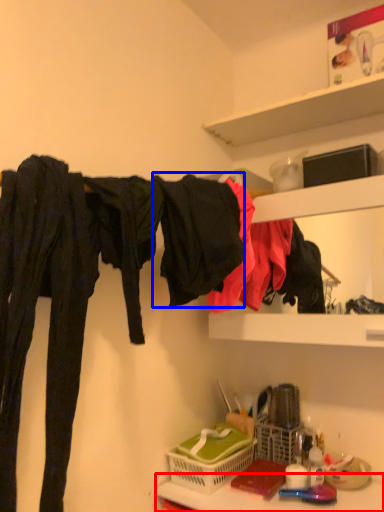
Question: Which object appears closest to the camera in this image, counter top (highlighted by a red box) or clothing (highlighted by a blue box)?

Choices:
 (A) counter top
 (B) clothing

Answer: (A)